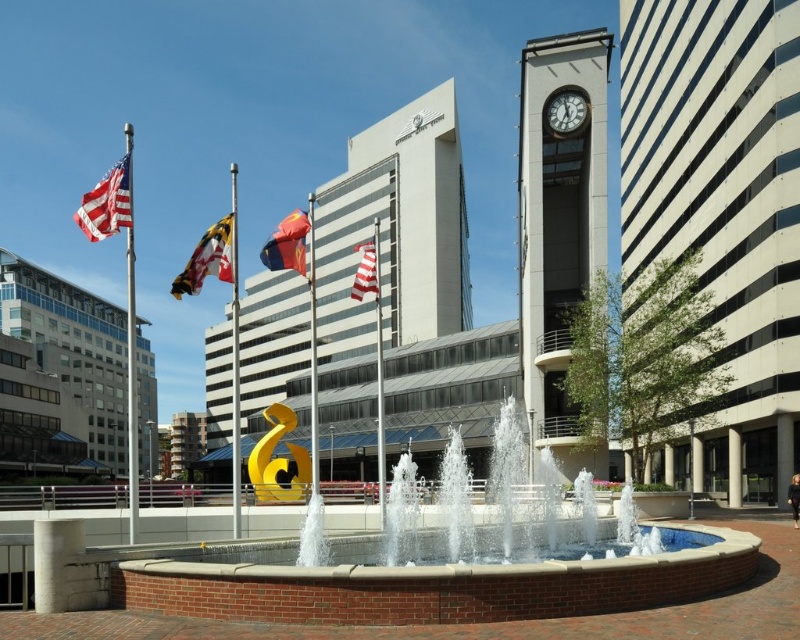
Can you confirm if brick fountain at center is taller than white glossy clock at upper center?

Correct, brick fountain at center is much taller as white glossy clock at upper center.

Can you confirm if brick fountain at center is positioned to the right of white glossy clock at upper center?

Incorrect, brick fountain at center is not on the right side of white glossy clock at upper center.

The height and width of the screenshot is (640, 800). What do you see at coordinates (436, 579) in the screenshot?
I see `brick fountain at center` at bounding box center [436, 579].

Locate an element on the screen. The image size is (800, 640). brick fountain at center is located at coordinates (436, 579).

Does white and blue striped flag at center have a larger size compared to red fabric flag at center?

No.

Does white and blue striped flag at center appear over red fabric flag at center?

Actually, white and blue striped flag at center is below red fabric flag at center.

Where is `white and blue striped flag at center`? This screenshot has height=640, width=800. white and blue striped flag at center is located at coordinates (208, 259).

Locate an element on the screen. The height and width of the screenshot is (640, 800). white and blue striped flag at center is located at coordinates (208, 259).

Locate an element on the screen. This screenshot has height=640, width=800. brick fountain at center is located at coordinates (436, 579).

Is brick fountain at center taller than white glass clock tower at upper right?

Incorrect, brick fountain at center's height is not larger of white glass clock tower at upper right's.

Who is more forward, (164, 560) or (600, 72)?

Positioned in front is point (164, 560).

Locate an element on the screen. Image resolution: width=800 pixels, height=640 pixels. brick fountain at center is located at coordinates (436, 579).